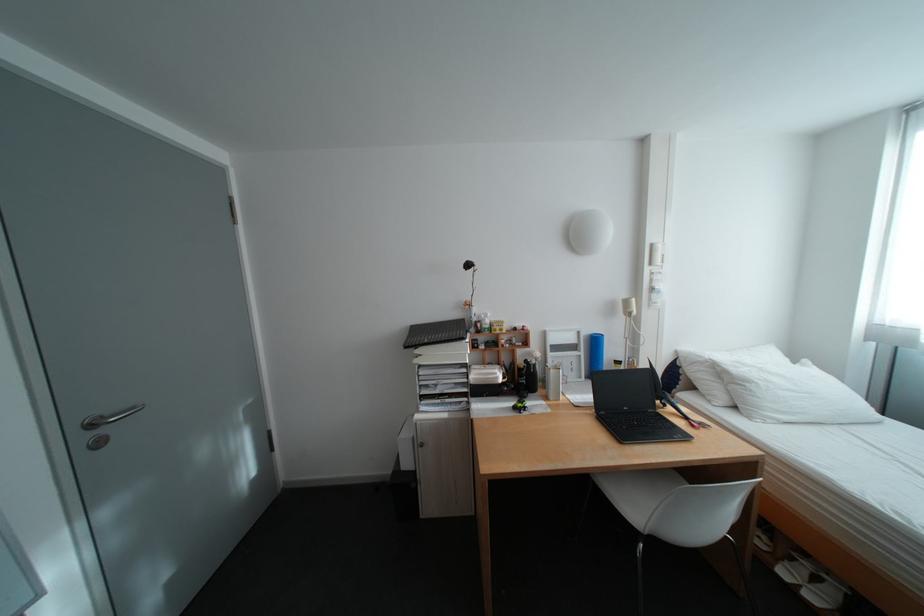
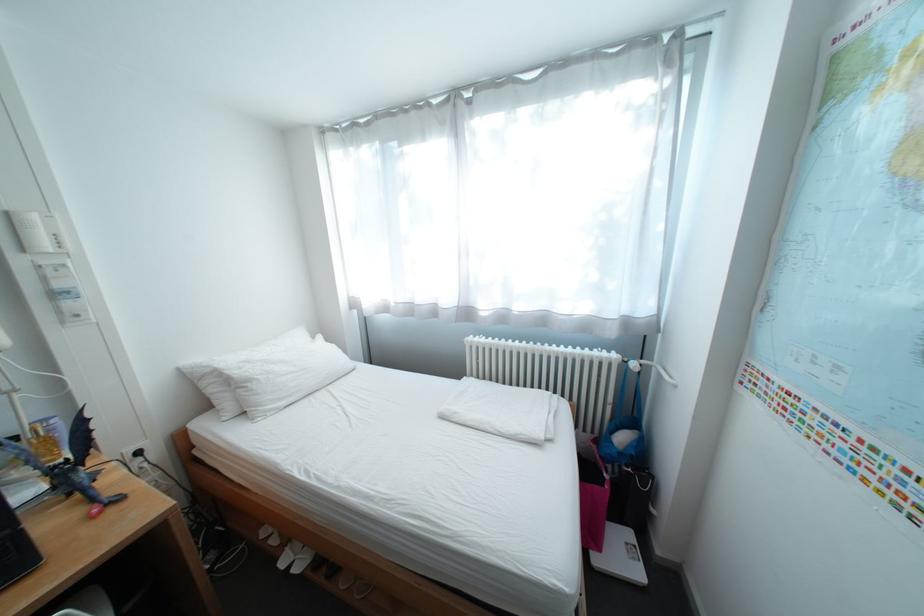
The point at (634, 365) is marked in the first image. Where is the corresponding point in the second image?

(31, 440)